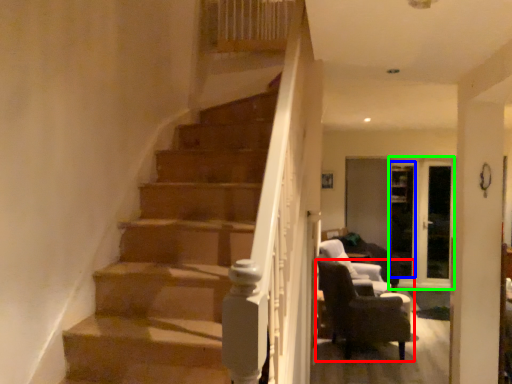
Question: Based on their relative distances, which object is farther from chair (highlighted by a red box)? Choose from glass door (highlighted by a blue box) and glass door (highlighted by a green box).

Choices:
 (A) glass door
 (B) glass door

Answer: (A)